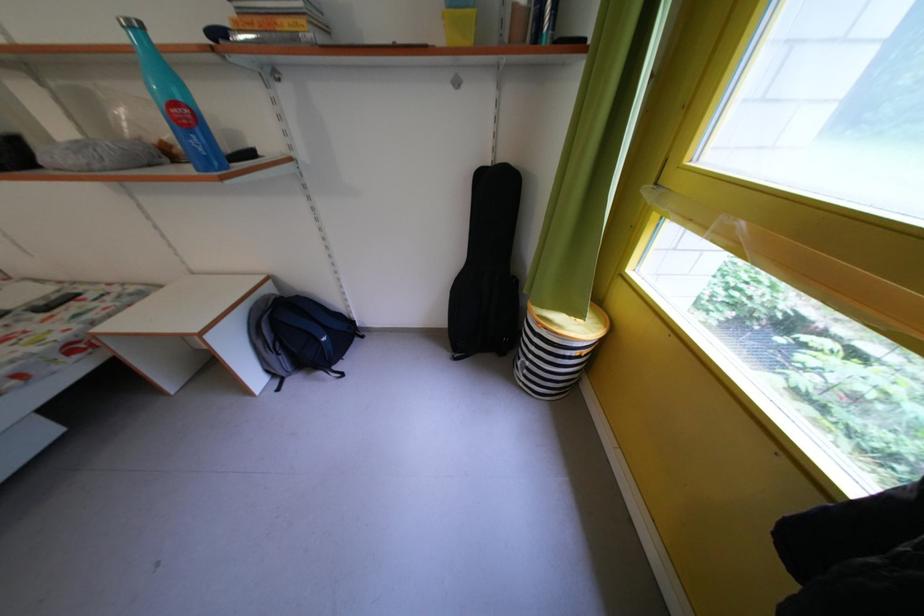
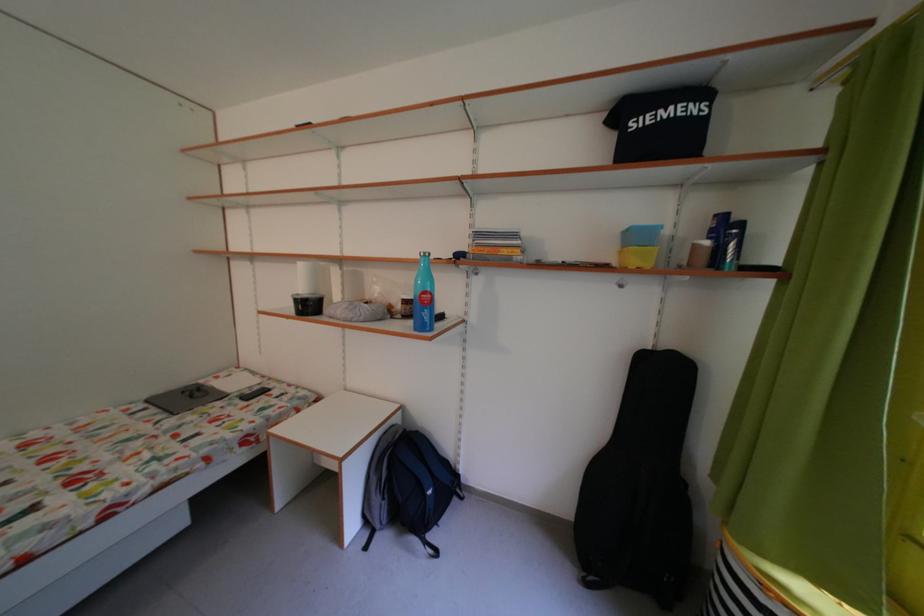
Find the pixel in the second image that matches (x=296, y=30) in the first image.

(515, 257)